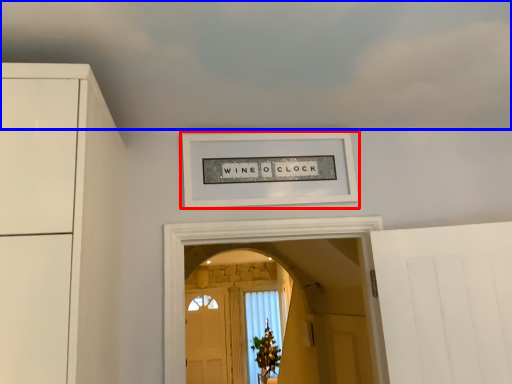
Question: Among these objects, which one is nearest to the camera, picture frame (highlighted by a red box) or cloud (highlighted by a blue box)?

Choices:
 (A) picture frame
 (B) cloud

Answer: (B)